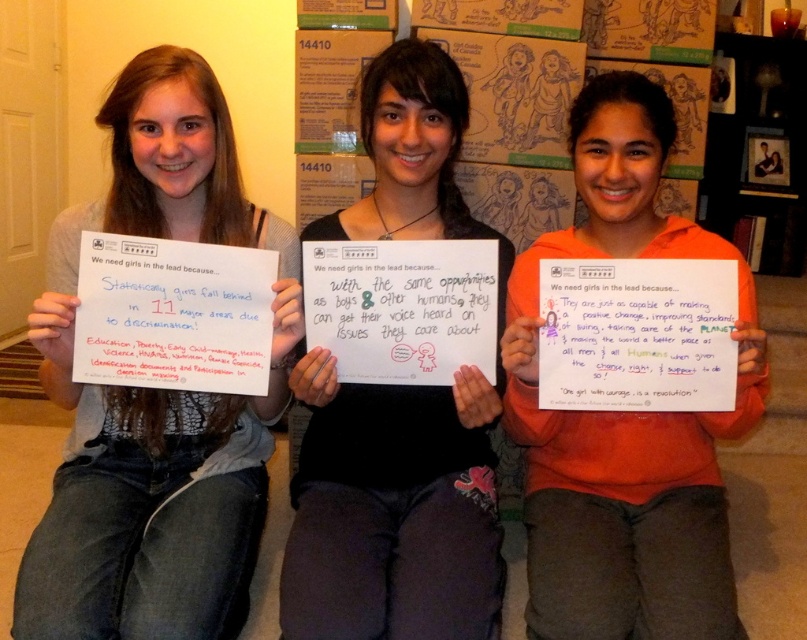
In the scene shown: You are organizing items for a charity drive and need to decide whether the gray sweater at center can be folded and placed inside the white paper at center. Based on their sizes, what would you advise?

The gray sweater at center has a larger size compared to white paper at center, so it cannot be folded and placed inside the white paper at center.

You are standing in the room and want to hand a pen to both the gray sweater at center and the white paper at center. Which one should you approach first to reach without moving around the other?

You should approach the gray sweater at center first because it is closer to you than the white paper at center, so you can reach it without needing to move around the other object.